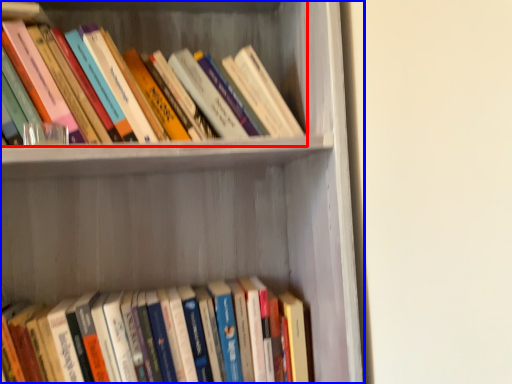
Question: Which object appears farthest to the camera in this image, book (highlighted by a red box) or shelf (highlighted by a blue box)?

Choices:
 (A) book
 (B) shelf

Answer: (A)